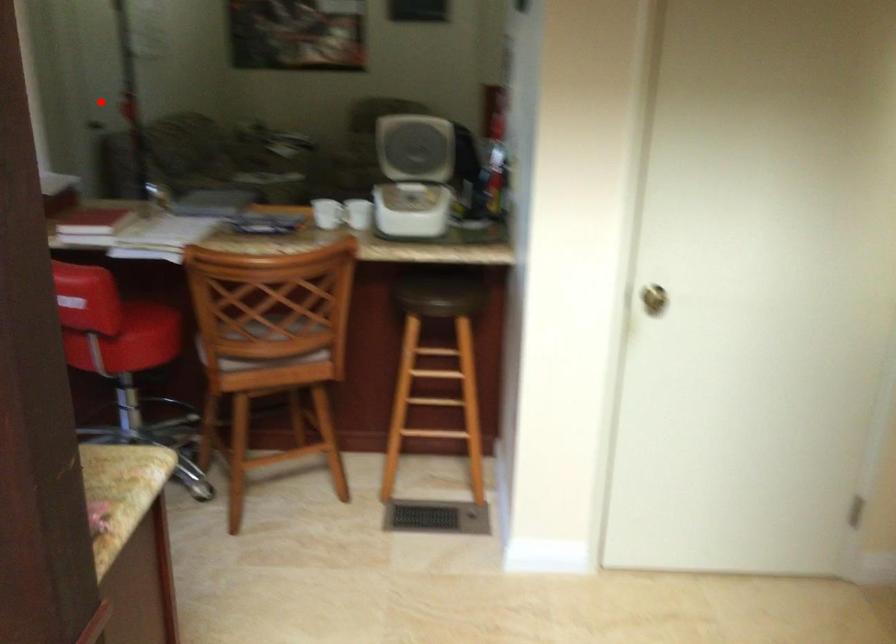
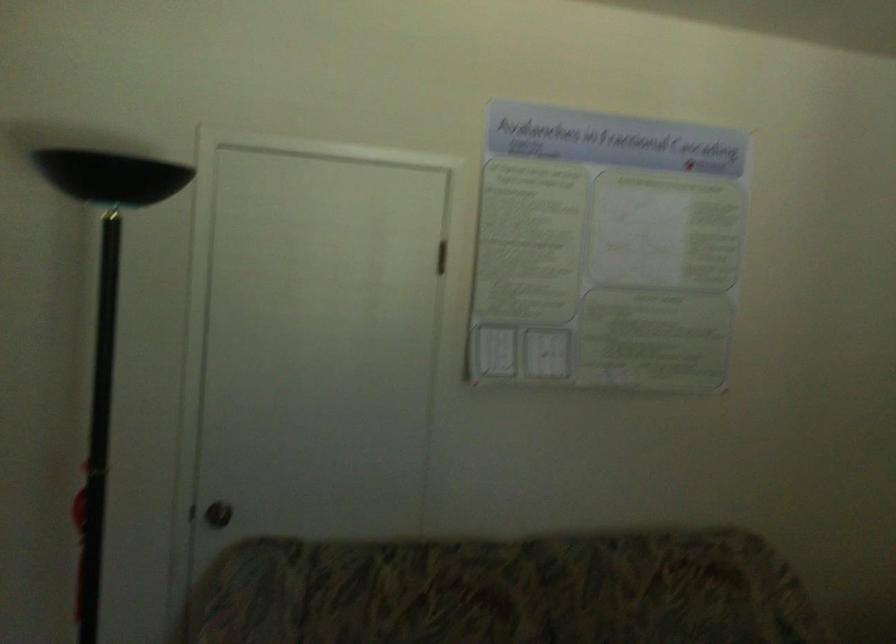
Question: I am providing you with two images of the same scene from different viewpoints. In image1, a red point is highlighted. Considering the same 3D point in image2, which of the following is correct?

Choices:
 (A) It is closer
 (B) It is farther

Answer: (A)